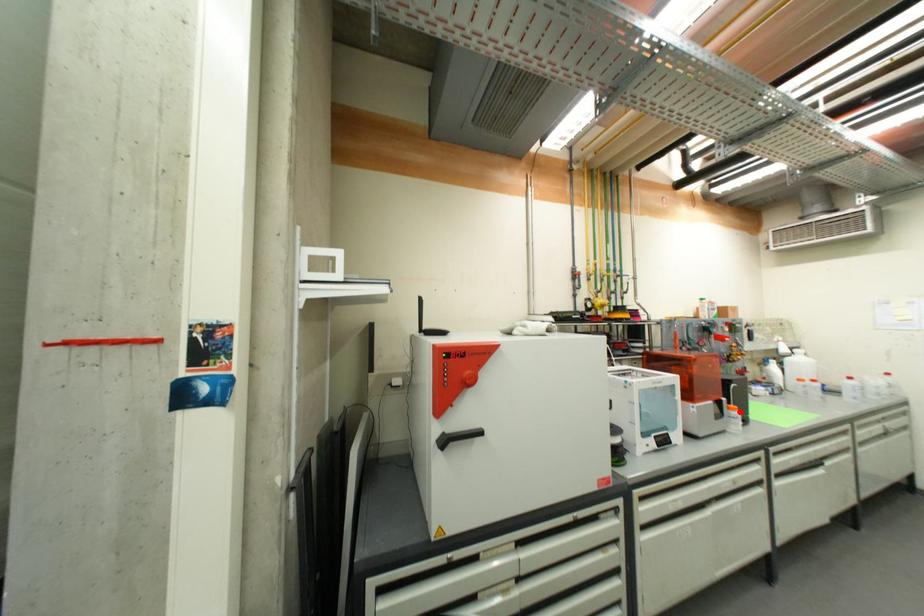
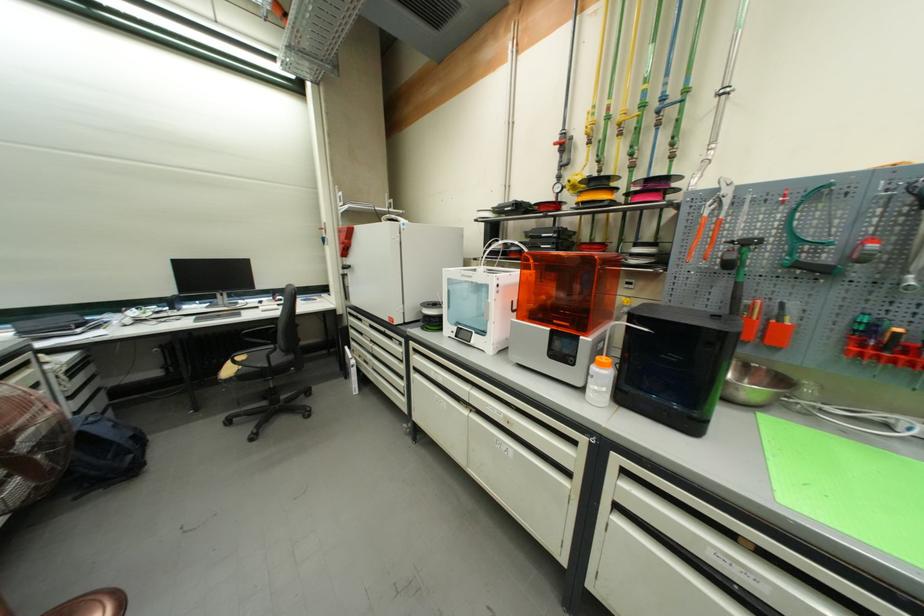
Locate, in the second image, the point that corresponds to the highlighted location in the first image.

(606, 367)